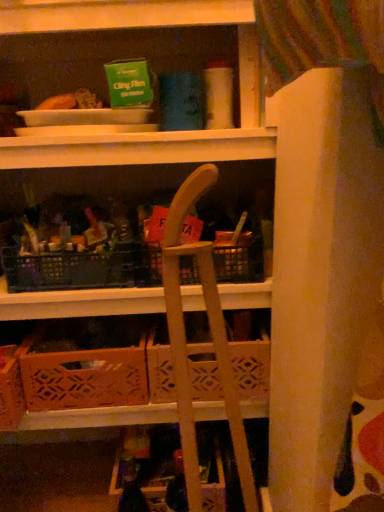
Question: Does wooden crate at center have a greater height compared to wooden folding chair at center?

Choices:
 (A) yes
 (B) no

Answer: (B)

Question: Is wooden crate at center at the right side of wooden folding chair at center?

Choices:
 (A) yes
 (B) no

Answer: (A)

Question: Can you confirm if wooden crate at center is smaller than wooden folding chair at center?

Choices:
 (A) no
 (B) yes

Answer: (B)

Question: From the image's perspective, is wooden crate at center on top of wooden folding chair at center?

Choices:
 (A) no
 (B) yes

Answer: (B)

Question: Would you say wooden folding chair at center is part of wooden crate at center's contents?

Choices:
 (A) yes
 (B) no

Answer: (B)

Question: Can you confirm if wooden crate at center is positioned to the left of wooden folding chair at center?

Choices:
 (A) no
 (B) yes

Answer: (A)

Question: Is wooden crate at center taller than wooden crate at lower center?

Choices:
 (A) no
 (B) yes

Answer: (B)

Question: Does wooden crate at center have a larger size compared to wooden crate at lower center?

Choices:
 (A) yes
 (B) no

Answer: (A)

Question: Is wooden crate at center not near wooden crate at lower center?

Choices:
 (A) no
 (B) yes

Answer: (A)

Question: Does wooden crate at center have a greater width compared to wooden crate at lower center?

Choices:
 (A) yes
 (B) no

Answer: (B)

Question: From the image's perspective, is wooden crate at center located above wooden crate at lower center?

Choices:
 (A) yes
 (B) no

Answer: (A)

Question: Is wooden crate at center in front of wooden crate at lower center?

Choices:
 (A) no
 (B) yes

Answer: (A)

Question: Considering the relative positions of wooden folding chair at center and wooden crate at center in the image provided, is wooden folding chair at center to the left of wooden crate at center from the viewer's perspective?

Choices:
 (A) no
 (B) yes

Answer: (B)